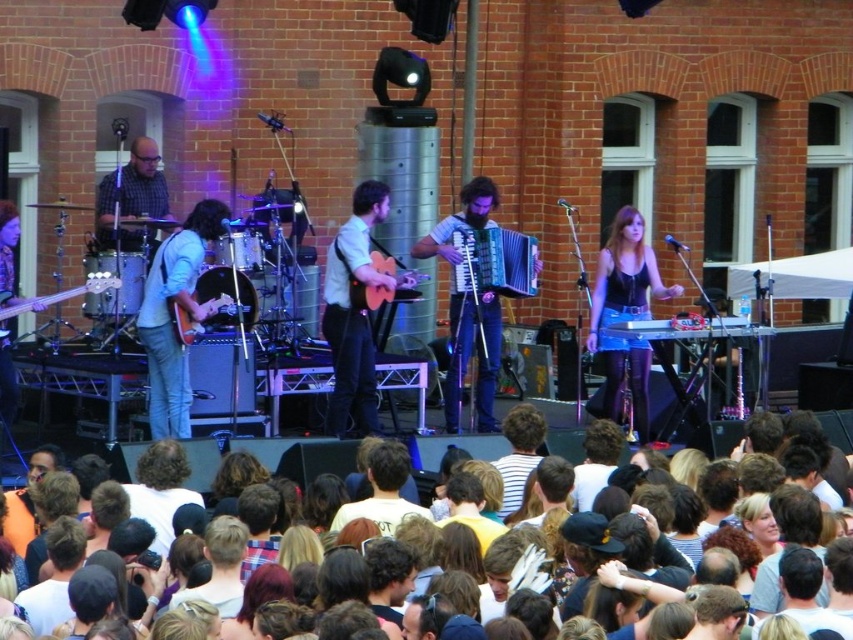
Which of these two, matte wood guitar at left or metallic silver keyboard at center, stands taller?

Standing taller between the two is matte wood guitar at left.

Between matte wood guitar at left and metallic silver keyboard at center, which one appears on the right side from the viewer's perspective?

metallic silver keyboard at center

The height and width of the screenshot is (640, 853). In order to click on matte wood guitar at left in this screenshot , I will do `click(228, 296)`.

At what (x,y) coordinates should I click in order to perform the action: click on matte wood guitar at left. Please return your answer as a coordinate pair (x, y). Looking at the image, I should click on (228, 296).

Is point (444, 241) in front of point (206, 280)?

No, it is not.

Can you confirm if wooden accordion at center is positioned to the right of matte wood guitar at left?

Yes, wooden accordion at center is to the right of matte wood guitar at left.

You are a GUI agent. You are given a task and a screenshot of the screen. Output one action in this format:
    pyautogui.click(x=<x>, y=<y>)
    Task: Click on the wooden accordion at center
    Image resolution: width=853 pixels, height=640 pixels.
    Given the screenshot: What is the action you would take?
    pyautogui.click(x=468, y=307)

What do you see at coordinates (355, 310) in the screenshot? The height and width of the screenshot is (640, 853). I see `matte wood guitar at center` at bounding box center [355, 310].

Who is more forward, (x=370, y=337) or (x=376, y=272)?

Point (x=376, y=272) is in front.

I want to click on matte wood guitar at center, so click(355, 310).